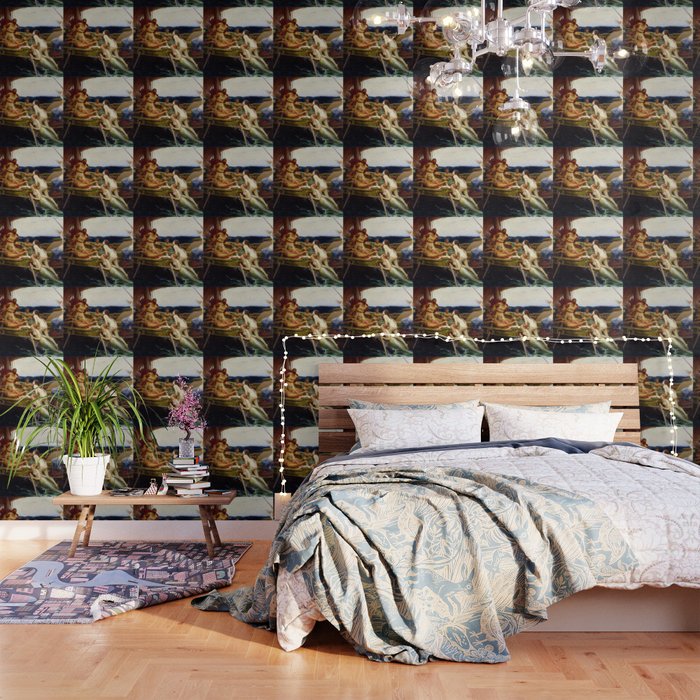
This screenshot has width=700, height=700. In order to click on books in this screenshot , I will do `click(178, 458)`, `click(189, 479)`.